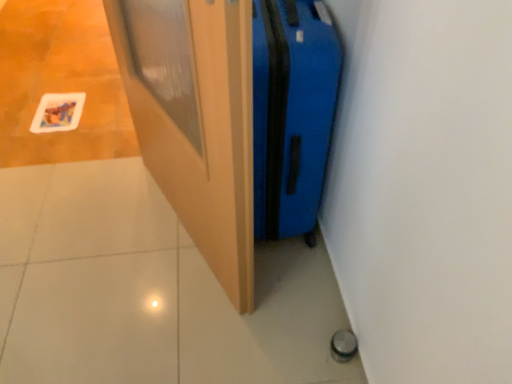
Identify the location of vacant space in wooden door at center (from a real-world perspective). (178, 231).